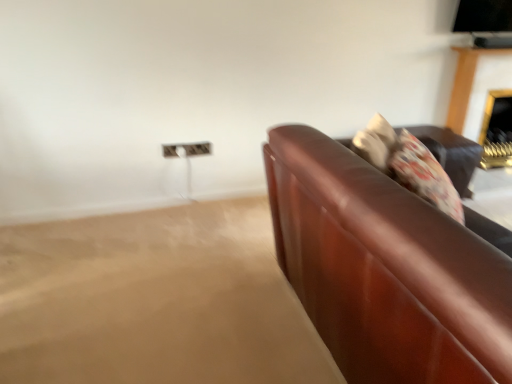
Describe the element at coordinates (385, 269) in the screenshot. I see `glossy leather couch at right` at that location.

The width and height of the screenshot is (512, 384). Identify the location of glossy leather couch at right. (385, 269).

This screenshot has width=512, height=384. I want to click on glossy leather couch at right, so click(x=385, y=269).